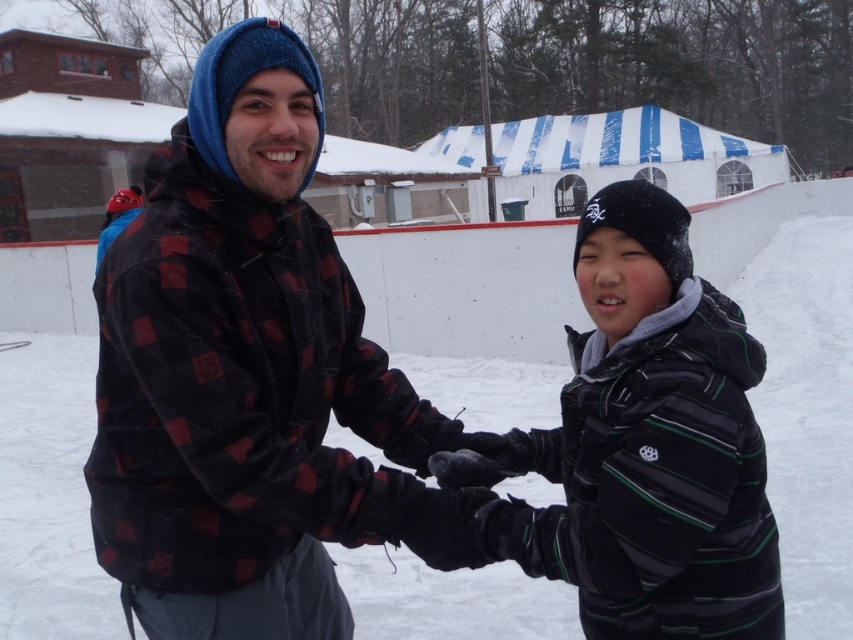
Question: Observing the image, what is the correct spatial positioning of plaid fabric jacket at center in reference to striped fleece jacket at center?

Choices:
 (A) below
 (B) above

Answer: (B)

Question: Is plaid fabric jacket at center positioned in front of white fluffy snow at center?

Choices:
 (A) no
 (B) yes

Answer: (B)

Question: Which object is the closest to the white fluffy snow at center?

Choices:
 (A) plaid fabric jacket at center
 (B) striped fleece jacket at center

Answer: (A)

Question: Can you confirm if plaid fabric jacket at center is positioned above striped fleece jacket at center?

Choices:
 (A) yes
 (B) no

Answer: (A)

Question: Which object is the farthest from the striped fleece jacket at center?

Choices:
 (A) plaid fabric jacket at center
 (B) white fluffy snow at center

Answer: (B)

Question: Among these points, which one is nearest to the camera?

Choices:
 (A) (12, 419)
 (B) (158, 356)
 (C) (637, 529)

Answer: (C)